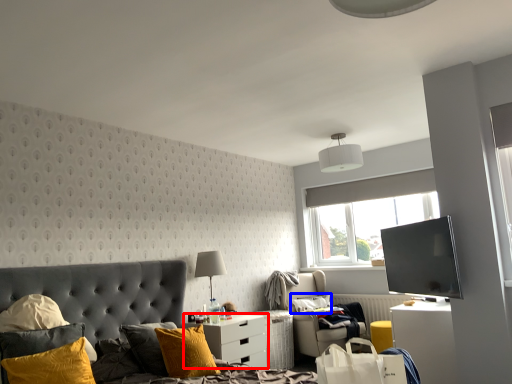
Question: Which point is closer to the camera, nightstand (highlighted by a red box) or pillow (highlighted by a blue box)?

Choices:
 (A) nightstand
 (B) pillow

Answer: (A)